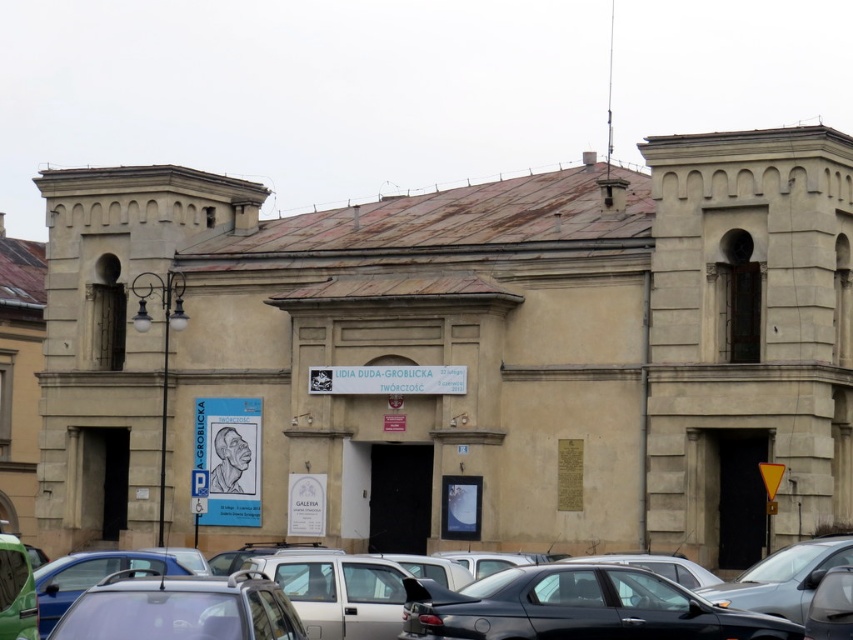
You are a tour guide leading visitors to the historical building. You see a satin silver car at lower center and a metallic gray car at lower right. Which car is smaller in size?

The satin silver car at lower center is smaller in size compared to the metallic gray car at lower right.

You are driving a car that is 15 feet long. You want to park between the metallic gray cars at lower center and the metallic gray car at lower right. Can your car fit in the space between them?

The space between the metallic gray cars at lower center and the metallic gray car at lower right is 7.29 feet. Since your car is 15 feet long, it cannot fit in that space.